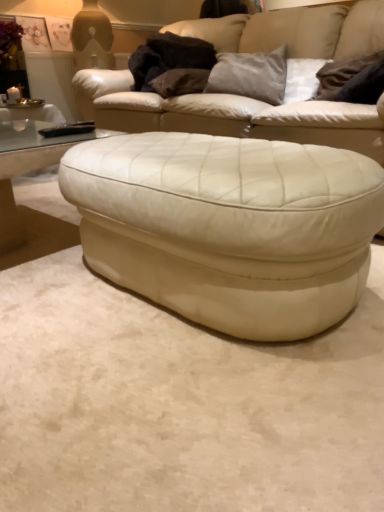
Question: From a real-world perspective, does transparent glass coffee table at lower left stand above white leather ottoman at center?

Choices:
 (A) no
 (B) yes

Answer: (A)

Question: Is transparent glass coffee table at lower left wider than white leather ottoman at center?

Choices:
 (A) no
 (B) yes

Answer: (B)

Question: From the image's perspective, is transparent glass coffee table at lower left above white leather ottoman at center?

Choices:
 (A) no
 (B) yes

Answer: (B)

Question: Is transparent glass coffee table at lower left at the right side of white leather ottoman at center?

Choices:
 (A) yes
 (B) no

Answer: (B)

Question: Is white leather ottoman at center surrounded by transparent glass coffee table at lower left?

Choices:
 (A) no
 (B) yes

Answer: (A)

Question: Looking at their shapes, would you say transparent glass coffee table at lower left is wider or thinner than suede gray pillow at upper center, arranged as the 2th pillow when viewed from the right?

Choices:
 (A) thin
 (B) wide

Answer: (B)

Question: From a real-world perspective, is transparent glass coffee table at lower left physically located above or below suede gray pillow at upper center, positioned as the second pillow in left-to-right order?

Choices:
 (A) below
 (B) above

Answer: (A)

Question: From the image's perspective, is transparent glass coffee table at lower left located above or below suede gray pillow at upper center, arranged as the 2th pillow when viewed from the right?

Choices:
 (A) below
 (B) above

Answer: (A)

Question: Is point (13, 168) closer or farther from the camera than point (205, 91)?

Choices:
 (A) farther
 (B) closer

Answer: (B)

Question: Relative to velvet brown pillow at upper center, the third pillow from the right, is white leather studio couch at center in front or behind?

Choices:
 (A) behind
 (B) front

Answer: (B)

Question: Looking at the image, does white leather studio couch at center seem bigger or smaller compared to velvet brown pillow at upper center, the third pillow from the right?

Choices:
 (A) big
 (B) small

Answer: (A)

Question: Is white leather studio couch at center to the left or to the right of velvet brown pillow at upper center, which is counted as the first pillow, starting from the left, in the image?

Choices:
 (A) left
 (B) right

Answer: (B)

Question: Is point (248, 119) positioned closer to the camera than point (188, 80)?

Choices:
 (A) closer
 (B) farther

Answer: (A)

Question: Does point (311, 104) appear closer or farther from the camera than point (268, 66)?

Choices:
 (A) closer
 (B) farther

Answer: (A)

Question: Is white leather studio couch at center wider or thinner than suede gray pillow at upper center, arranged as the 2th pillow when viewed from the right?

Choices:
 (A) thin
 (B) wide

Answer: (B)